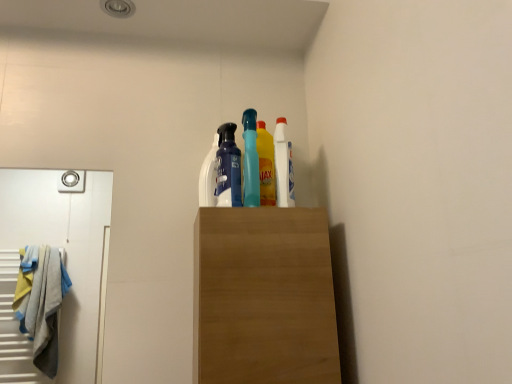
Question: Does white glossy bottle at upper center, the 2th cleaning product viewed from the right, have a smaller size compared to white plastic bottle at upper center, which ranks as the 2th cleaning product in left-to-right order?

Choices:
 (A) yes
 (B) no

Answer: (A)

Question: Is white glossy bottle at upper center, the 2th cleaning product viewed from the right, facing towards white plastic bottle at upper center, which ranks as the 2th cleaning product in left-to-right order?

Choices:
 (A) no
 (B) yes

Answer: (A)

Question: From the image's perspective, is white glossy bottle at upper center, which is the 1th cleaning product from left to right, beneath white plastic bottle at upper center, marked as the 1th cleaning product in a right-to-left arrangement?

Choices:
 (A) yes
 (B) no

Answer: (A)

Question: From the image's perspective, is white glossy bottle at upper center, which is the 1th cleaning product from left to right, on top of white plastic bottle at upper center, which ranks as the 2th cleaning product in left-to-right order?

Choices:
 (A) no
 (B) yes

Answer: (A)

Question: Considering the relative sizes of white glossy bottle at upper center, which is the 1th cleaning product from left to right, and white plastic bottle at upper center, which ranks as the 2th cleaning product in left-to-right order, in the image provided, is white glossy bottle at upper center, which is the 1th cleaning product from left to right, wider than white plastic bottle at upper center, which ranks as the 2th cleaning product in left-to-right order,?

Choices:
 (A) no
 (B) yes

Answer: (A)

Question: Is white glossy bottle at upper center, the 2th cleaning product viewed from the right, not within white plastic bottle at upper center, which ranks as the 2th cleaning product in left-to-right order?

Choices:
 (A) yes
 (B) no

Answer: (A)

Question: Can you confirm if white glossy bottle at upper center, which is the 1th cleaning product from left to right, is bigger than matte blue spray bottle at center?

Choices:
 (A) no
 (B) yes

Answer: (A)

Question: Is matte blue spray bottle at center at the back of white glossy bottle at upper center, which is the 1th cleaning product from left to right?

Choices:
 (A) no
 (B) yes

Answer: (A)

Question: Is white glossy bottle at upper center, the 2th cleaning product viewed from the right, shorter than matte blue spray bottle at center?

Choices:
 (A) yes
 (B) no

Answer: (B)

Question: Does white glossy bottle at upper center, the 2th cleaning product viewed from the right, have a greater width compared to matte blue spray bottle at center?

Choices:
 (A) no
 (B) yes

Answer: (A)

Question: Considering the relative sizes of white glossy bottle at upper center, the 2th cleaning product viewed from the right, and matte blue spray bottle at center in the image provided, is white glossy bottle at upper center, the 2th cleaning product viewed from the right, taller than matte blue spray bottle at center?

Choices:
 (A) yes
 (B) no

Answer: (A)

Question: Considering the relative positions of white glossy bottle at upper center, the 2th cleaning product viewed from the right, and matte blue spray bottle at center in the image provided, is white glossy bottle at upper center, the 2th cleaning product viewed from the right, behind matte blue spray bottle at center?

Choices:
 (A) no
 (B) yes

Answer: (B)

Question: Is matte blue spray bottle at center further to camera compared to white glossy bottle at upper center, the 2th cleaning product viewed from the right?

Choices:
 (A) no
 (B) yes

Answer: (A)